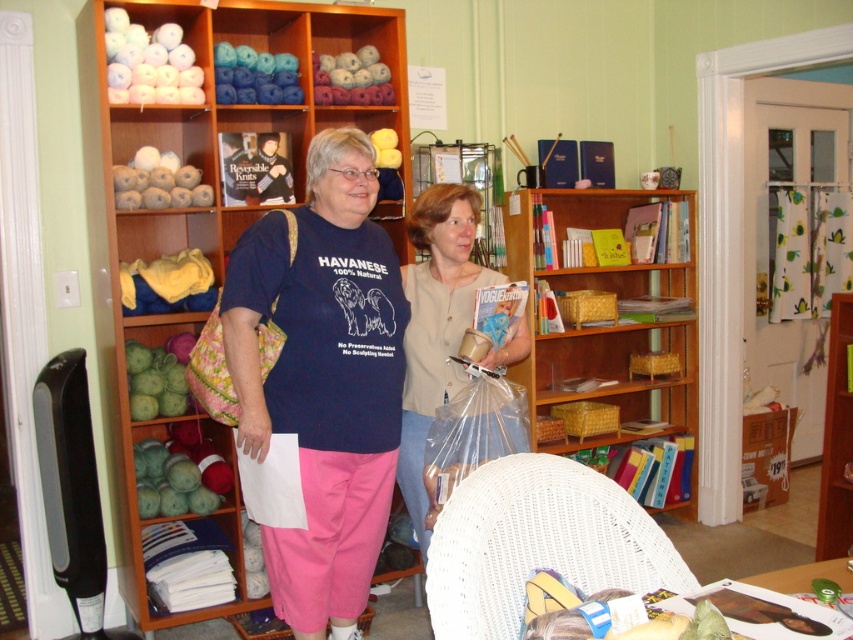
Based on the photo, you are organizing a display in the craft shop and need to place the beige fabric sweater at center on a shelf. The shelf you have in mind is currently occupied by the wooden bookshelf at left. Considering their widths, will the sweater fit on the shelf if you remove the bookshelf?

The wooden bookshelf at left is wider than the beige fabric sweater at center. Therefore, if you remove the wooden bookshelf at left, the shelf will have enough space to accommodate the beige fabric sweater at center since it is narrower.